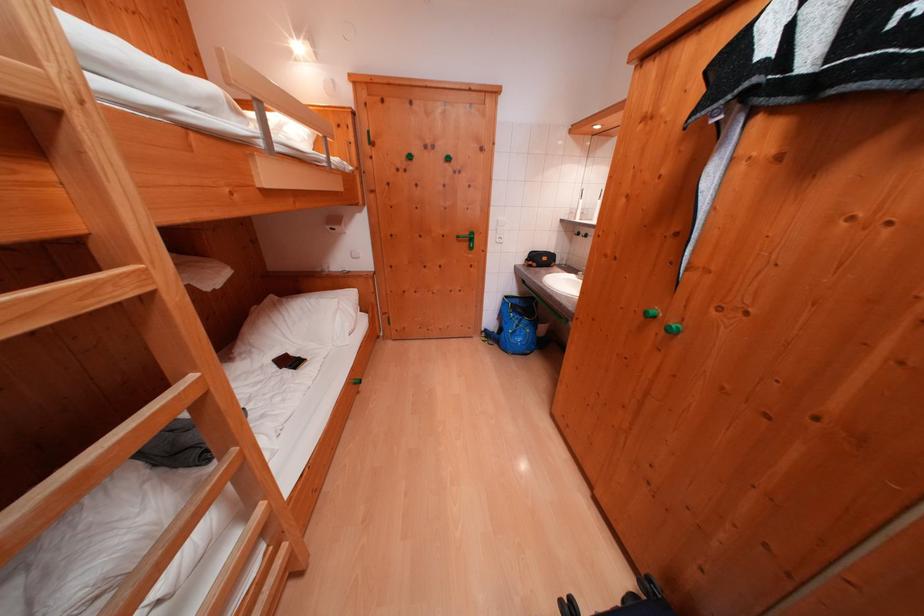
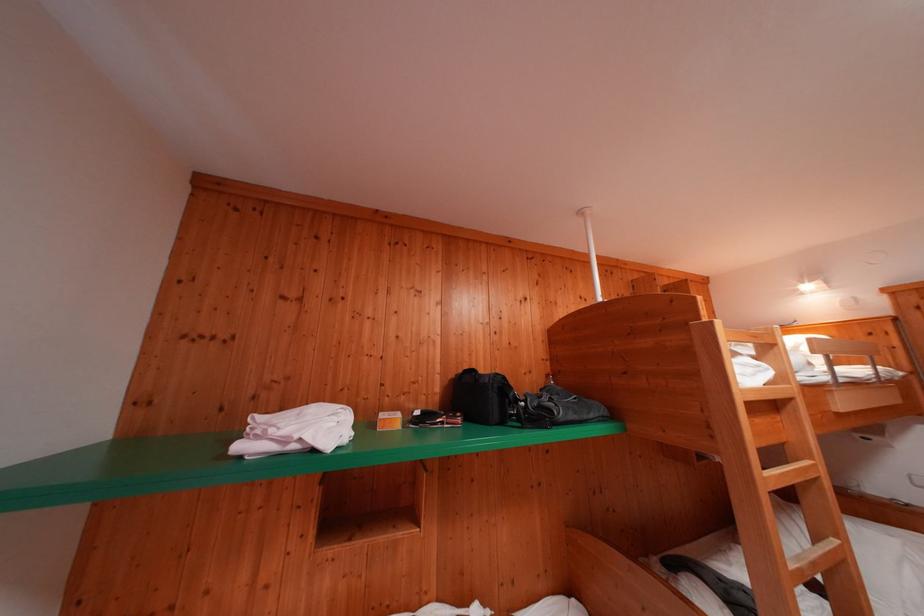
The point at [201,381] is marked in the first image. Where is the corresponding point in the second image?

(843, 545)